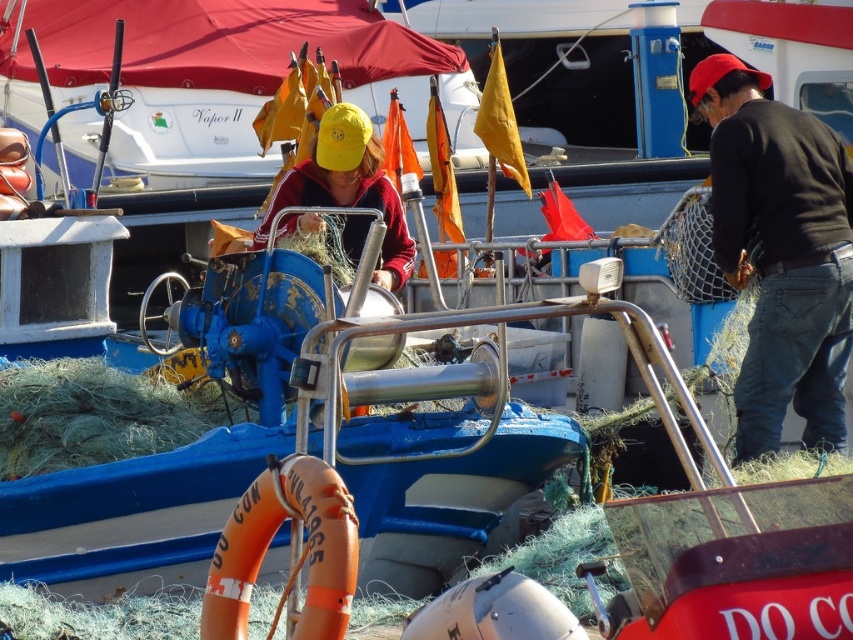
Question: Which point is closer to the camera?

Choices:
 (A) (294, 195)
 (B) (258, 548)

Answer: (B)

Question: Is orange rubber life jacket at lower center wider than matte red jacket at center?

Choices:
 (A) no
 (B) yes

Answer: (A)

Question: Which of the following is the closest to the observer?

Choices:
 (A) orange rubber life jacket at lower center
 (B) matte red jacket at center

Answer: (A)

Question: Is black cotton shirt at right further to the viewer compared to orange rubber life jacket at lower center?

Choices:
 (A) yes
 (B) no

Answer: (A)

Question: Does orange rubber life jacket at lower center have a lesser width compared to matte red jacket at center?

Choices:
 (A) no
 (B) yes

Answer: (B)

Question: Which point is farther from the camera taking this photo?

Choices:
 (A) (340, 122)
 (B) (840, 236)

Answer: (A)